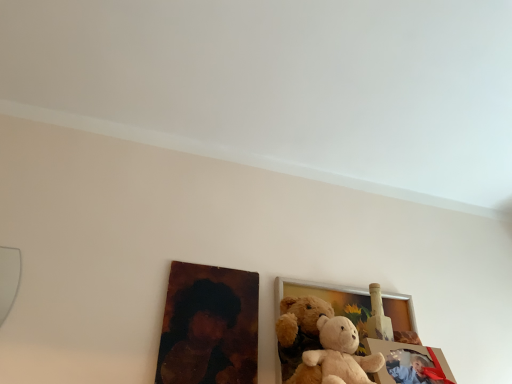
The height and width of the screenshot is (384, 512). Describe the element at coordinates (300, 336) in the screenshot. I see `soft plush teddy bear at center` at that location.

Where is `oil painting portrait at lower left`? Image resolution: width=512 pixels, height=384 pixels. oil painting portrait at lower left is located at coordinates (197, 334).

This screenshot has height=384, width=512. What do you see at coordinates (197, 334) in the screenshot?
I see `oil painting portrait at lower left` at bounding box center [197, 334].

Image resolution: width=512 pixels, height=384 pixels. In order to click on wooden photo frame at center, which appears as the 2th picture frame when viewed from the front in this screenshot , I will do `click(329, 301)`.

Is wooden photo frame at center, which appears as the 2th picture frame when viewed from the front, taller than soft plush teddy bear at center?

Yes, wooden photo frame at center, which appears as the 2th picture frame when viewed from the front, is taller than soft plush teddy bear at center.

Considering the sizes of objects wooden photo frame at center, positioned as the 1th picture frame in back-to-front order, and soft plush teddy bear at center in the image provided, who is wider, wooden photo frame at center, positioned as the 1th picture frame in back-to-front order, or soft plush teddy bear at center?

Wider between the two is soft plush teddy bear at center.

From a real-world perspective, between wooden photo frame at center, which appears as the 2th picture frame when viewed from the front, and soft plush teddy bear at center, who is vertically lower?

In real-world perspective, soft plush teddy bear at center is lower.

Is wooden photo frame at center, which appears as the 2th picture frame when viewed from the front, positioned before soft plush teddy bear at center?

No, wooden photo frame at center, which appears as the 2th picture frame when viewed from the front, is behind soft plush teddy bear at center.

From a real-world perspective, is oil painting portrait at lower left on matte plastic picture frame at lower right, placed as the 1th picture frame when sorted from front to back?

Yes, from a real-world perspective, oil painting portrait at lower left is on top of matte plastic picture frame at lower right, placed as the 1th picture frame when sorted from front to back.

Does oil painting portrait at lower left have a greater width compared to matte plastic picture frame at lower right, placed as the 1th picture frame when sorted from front to back?

No.

Considering the positions of point (210, 383) and point (369, 348), is point (210, 383) closer or farther from the camera than point (369, 348)?

Point (210, 383) is closer to the camera than point (369, 348).

From the image's perspective, between oil painting portrait at lower left and matte plastic picture frame at lower right, acting as the 2th picture frame starting from the back, which one is located above?

oil painting portrait at lower left, from the image's perspective.

From the oil painting portrait at lower left, count 1st picture frame to the right and point to it. Please provide its 2D coordinates.

[(329, 301)]

Does oil painting portrait at lower left have a greater width compared to wooden photo frame at center, positioned as the 1th picture frame in back-to-front order?

No, oil painting portrait at lower left is not wider than wooden photo frame at center, positioned as the 1th picture frame in back-to-front order.

Is wooden photo frame at center, positioned as the 1th picture frame in back-to-front order, inside oil painting portrait at lower left?

No, wooden photo frame at center, positioned as the 1th picture frame in back-to-front order, is not surrounded by oil painting portrait at lower left.

Which of these two, soft plush teddy bear at center or wooden photo frame at center, positioned as the 1th picture frame in back-to-front order, is bigger?

wooden photo frame at center, positioned as the 1th picture frame in back-to-front order.

Considering the positions of points (316, 318) and (289, 281), is point (316, 318) farther from camera compared to point (289, 281)?

No, it is not.

Is the position of soft plush teddy bear at center less distant than that of wooden photo frame at center, which appears as the 2th picture frame when viewed from the front?

Yes.

Consider the image. Is matte plastic picture frame at lower right, acting as the 2th picture frame starting from the back, looking in the opposite direction of oil painting portrait at lower left?

No, matte plastic picture frame at lower right, acting as the 2th picture frame starting from the back, is not facing the opposite direction of oil painting portrait at lower left.

Considering the sizes of objects matte plastic picture frame at lower right, acting as the 2th picture frame starting from the back, and oil painting portrait at lower left in the image provided, who is shorter, matte plastic picture frame at lower right, acting as the 2th picture frame starting from the back, or oil painting portrait at lower left?

matte plastic picture frame at lower right, acting as the 2th picture frame starting from the back, is shorter.

Does matte plastic picture frame at lower right, placed as the 1th picture frame when sorted from front to back, have a smaller size compared to oil painting portrait at lower left?

Indeed, matte plastic picture frame at lower right, placed as the 1th picture frame when sorted from front to back, has a smaller size compared to oil painting portrait at lower left.

From the picture: Between matte plastic picture frame at lower right, placed as the 1th picture frame when sorted from front to back, and oil painting portrait at lower left, which one appears on the left side from the viewer's perspective?

From the viewer's perspective, oil painting portrait at lower left appears more on the left side.

In order to click on picture frame behind the matte plastic picture frame at lower right, placed as the 1th picture frame when sorted from front to back in this screenshot , I will do `click(329, 301)`.

Does matte plastic picture frame at lower right, acting as the 2th picture frame starting from the back, turn towards wooden photo frame at center, positioned as the 1th picture frame in back-to-front order?

No, matte plastic picture frame at lower right, acting as the 2th picture frame starting from the back, does not turn towards wooden photo frame at center, positioned as the 1th picture frame in back-to-front order.

Which object is further away from the camera, matte plastic picture frame at lower right, acting as the 2th picture frame starting from the back, or wooden photo frame at center, which appears as the 2th picture frame when viewed from the front?

wooden photo frame at center, which appears as the 2th picture frame when viewed from the front, is further away from the camera.

From a real-world perspective, relative to wooden photo frame at center, which appears as the 2th picture frame when viewed from the front, is matte plastic picture frame at lower right, acting as the 2th picture frame starting from the back, vertically above or below?

matte plastic picture frame at lower right, acting as the 2th picture frame starting from the back, is situated lower than wooden photo frame at center, which appears as the 2th picture frame when viewed from the front, in the real world.

Are wooden photo frame at center, which appears as the 2th picture frame when viewed from the front, and matte plastic picture frame at lower right, placed as the 1th picture frame when sorted from front to back, far apart?

wooden photo frame at center, which appears as the 2th picture frame when viewed from the front, is actually quite close to matte plastic picture frame at lower right, placed as the 1th picture frame when sorted from front to back.

Is wooden photo frame at center, positioned as the 1th picture frame in back-to-front order, spatially inside matte plastic picture frame at lower right, placed as the 1th picture frame when sorted from front to back, or outside of it?

wooden photo frame at center, positioned as the 1th picture frame in back-to-front order, exists outside the volume of matte plastic picture frame at lower right, placed as the 1th picture frame when sorted from front to back.

Considering the relative sizes of wooden photo frame at center, positioned as the 1th picture frame in back-to-front order, and matte plastic picture frame at lower right, placed as the 1th picture frame when sorted from front to back, in the image provided, is wooden photo frame at center, positioned as the 1th picture frame in back-to-front order, bigger than matte plastic picture frame at lower right, placed as the 1th picture frame when sorted from front to back,?

Indeed, wooden photo frame at center, positioned as the 1th picture frame in back-to-front order, has a larger size compared to matte plastic picture frame at lower right, placed as the 1th picture frame when sorted from front to back.

Which picture frame is the 1st one when counting from the right side of the soft plush teddy bear at center? Please provide its 2D coordinates.

[(329, 301)]

Find the location of `person behind the matte plastic picture frame at lower right, acting as the 2th picture frame starting from the back`. person behind the matte plastic picture frame at lower right, acting as the 2th picture frame starting from the back is located at coordinates (197, 334).

Looking at this image, which object lies nearer to the anchor point soft plush teddy bear at center, wooden photo frame at center, which appears as the 2th picture frame when viewed from the front, or oil painting portrait at lower left?

wooden photo frame at center, which appears as the 2th picture frame when viewed from the front, lies closer to soft plush teddy bear at center than the other object.

Based on the photo, based on their spatial positions, is wooden photo frame at center, positioned as the 1th picture frame in back-to-front order, or matte plastic picture frame at lower right, acting as the 2th picture frame starting from the back, further from soft plush teddy bear at center?

Based on the image, matte plastic picture frame at lower right, acting as the 2th picture frame starting from the back, appears to be further to soft plush teddy bear at center.

Estimate the real-world distances between objects in this image. Which object is further from soft plush teddy bear at center, oil painting portrait at lower left or wooden photo frame at center, which appears as the 2th picture frame when viewed from the front?

Among the two, oil painting portrait at lower left is located further to soft plush teddy bear at center.

Which object lies nearer to the anchor point matte plastic picture frame at lower right, acting as the 2th picture frame starting from the back, wooden photo frame at center, which appears as the 2th picture frame when viewed from the front, or oil painting portrait at lower left?

wooden photo frame at center, which appears as the 2th picture frame when viewed from the front, lies closer to matte plastic picture frame at lower right, acting as the 2th picture frame starting from the back, than the other object.

Estimate the real-world distances between objects in this image. Which object is further from soft plush teddy bear at center, matte plastic picture frame at lower right, acting as the 2th picture frame starting from the back, or oil painting portrait at lower left?

oil painting portrait at lower left.

Looking at the image, which one is located closer to matte plastic picture frame at lower right, acting as the 2th picture frame starting from the back, wooden photo frame at center, positioned as the 1th picture frame in back-to-front order, or soft plush teddy bear at center?

wooden photo frame at center, positioned as the 1th picture frame in back-to-front order.

When comparing their distances from wooden photo frame at center, positioned as the 1th picture frame in back-to-front order, does soft plush teddy bear at center or oil painting portrait at lower left seem closer?

soft plush teddy bear at center is closer to wooden photo frame at center, positioned as the 1th picture frame in back-to-front order.

Which object lies further to the anchor point oil painting portrait at lower left, wooden photo frame at center, positioned as the 1th picture frame in back-to-front order, or matte plastic picture frame at lower right, acting as the 2th picture frame starting from the back?

matte plastic picture frame at lower right, acting as the 2th picture frame starting from the back, lies further to oil painting portrait at lower left than the other object.

Find the location of `teddy bear situated between oil painting portrait at lower left and wooden photo frame at center, positioned as the 1th picture frame in back-to-front order, from left to right`. teddy bear situated between oil painting portrait at lower left and wooden photo frame at center, positioned as the 1th picture frame in back-to-front order, from left to right is located at coordinates (300, 336).

Find the location of a particular element. Image resolution: width=512 pixels, height=384 pixels. picture frame situated between oil painting portrait at lower left and matte plastic picture frame at lower right, acting as the 2th picture frame starting from the back, from left to right is located at coordinates (329, 301).

Identify the location of teddy bear between oil painting portrait at lower left and matte plastic picture frame at lower right, acting as the 2th picture frame starting from the back. (300, 336).

Locate an element on the screen. The height and width of the screenshot is (384, 512). picture frame between soft plush teddy bear at center and matte plastic picture frame at lower right, acting as the 2th picture frame starting from the back, in the horizontal direction is located at coordinates (329, 301).